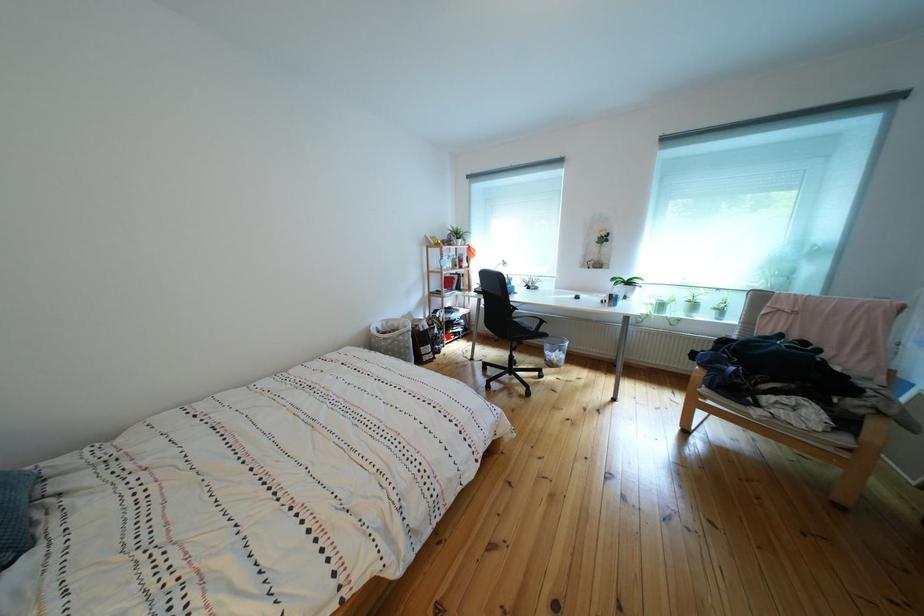
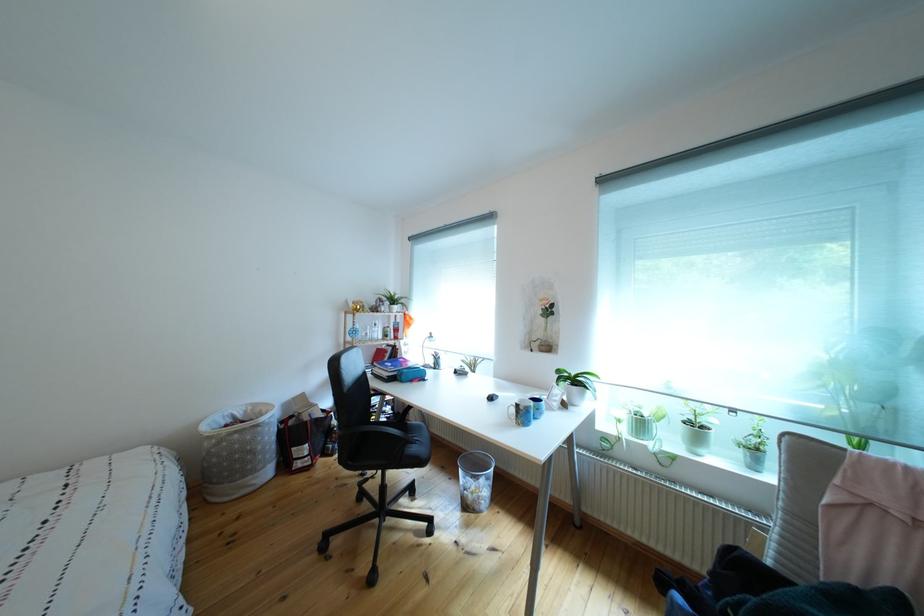
Question: I am providing you with two images of the same scene from different viewpoints. A red point is marked on the first image. At the location where the point appears in image 1, is it still visible in image 2?

Choices:
 (A) Yes
 (B) No

Answer: (A)